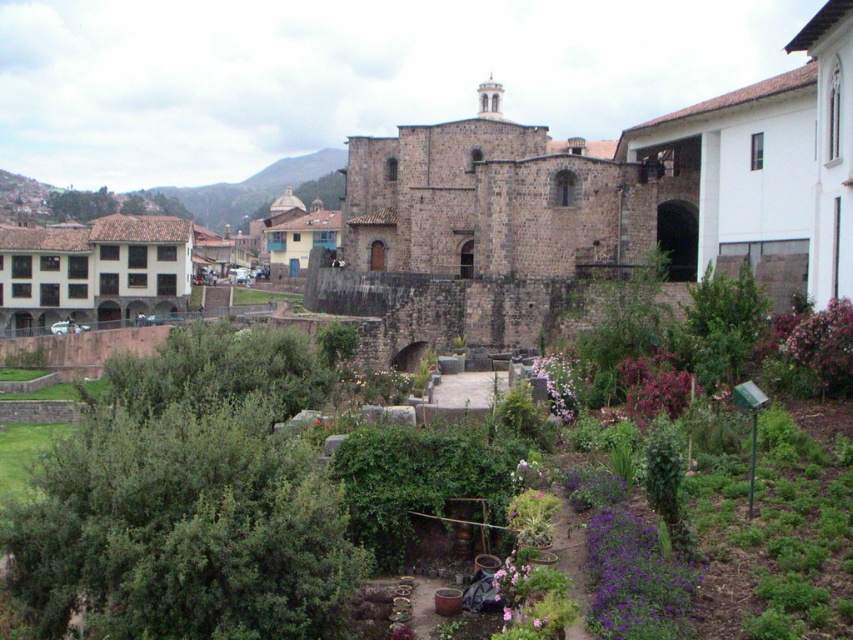
Question: Which of the following is the farthest from the observer?

Choices:
 (A) (167, 188)
 (B) (561, 250)
 (C) (215, 392)
 (D) (519, 301)

Answer: (A)

Question: Is brown stone wall at center above green leafy garden at center?

Choices:
 (A) no
 (B) yes

Answer: (B)

Question: Which of the following is the farthest from the observer?

Choices:
 (A) (196, 212)
 (B) (408, 220)
 (C) (845, 97)

Answer: (A)

Question: Is brown stone wall at center to the left of green grassy hillside at upper left from the viewer's perspective?

Choices:
 (A) no
 (B) yes

Answer: (A)

Question: Considering the real-world distances, which object is farthest from the green leafy garden at center?

Choices:
 (A) brown stone wall at center
 (B) green grassy hillside at upper left

Answer: (B)

Question: Is brown stone wall at center above green leafy garden at center?

Choices:
 (A) no
 (B) yes

Answer: (B)